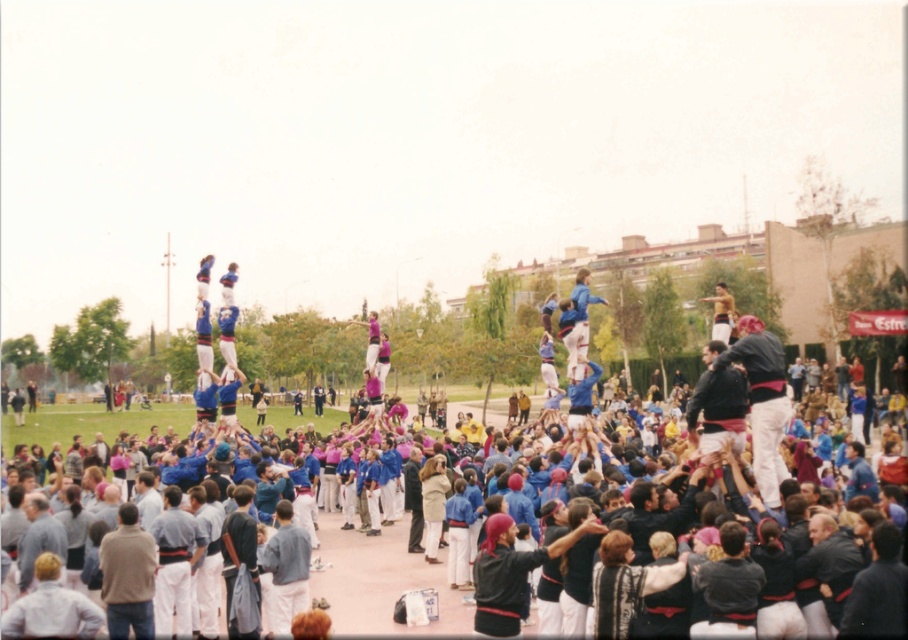
You are a photographer at the event and want to capture both the blue fabric crowd at center and the dark blue fabric at center in a single shot. Which object should you focus on first to ensure both are in frame?

The blue fabric crowd at center is larger in size compared to the dark blue fabric at center. To ensure both are in frame, focus on the larger blue fabric crowd at center first, then adjust the camera angle to include the smaller dark blue fabric at center.

You are a photographer positioned at the back of the crowd. You want to take a photo of the light beige coat at center and the dark blue fabric at center. Which object will appear taller in your photo?

The dark blue fabric at center will appear taller in the photo because it has a greater height compared to the light beige coat at center.

You are a photographer standing at the edge of the crowd. You want to take a photo of the human tower. However, there are two obstacles in your view. One is the blue fabric crowd at center, and the other is the light beige coat at center. Which obstacle is closer to you, making it block your view first?

The light beige coat at center is closer to you because it is shorter than the blue fabric crowd at center, which is taller and farther away.